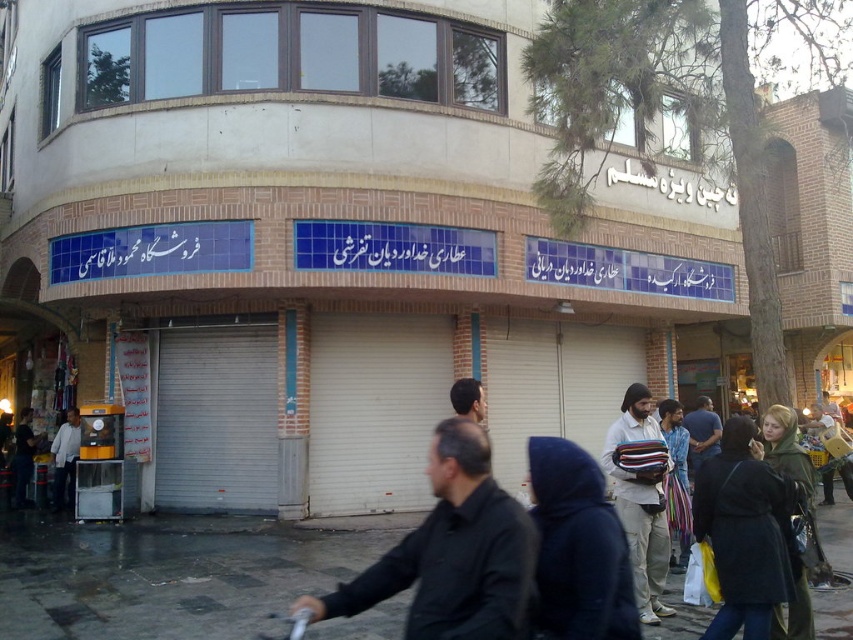
Question: Which of the following is the farthest from the observer?

Choices:
 (A) (64, 492)
 (B) (648, 493)
 (C) (241, 628)
 (D) (566, 488)

Answer: (A)

Question: Is dark blue coat at lower right to the right of beige fabric bag at center from the viewer's perspective?

Choices:
 (A) yes
 (B) no

Answer: (A)

Question: Does dark gray asphalt at lower center appear on the left side of light gray shirt at left?

Choices:
 (A) yes
 (B) no

Answer: (B)

Question: Which object is positioned closest to the light gray shirt at left?

Choices:
 (A) black matte jacket at center
 (B) dark gray asphalt at lower center
 (C) dark blue coat at lower right
 (D) dark brown leather jacket at center

Answer: (B)

Question: Which object is farther from the camera taking this photo?

Choices:
 (A) dark gray asphalt at lower center
 (B) dark brown leather jacket at lower left
 (C) dark brown leather jacket at center
 (D) dark blue hooded jacket at lower center

Answer: (B)

Question: Can you confirm if beige fabric bag at center is thinner than dark brown hair at center?

Choices:
 (A) yes
 (B) no

Answer: (B)